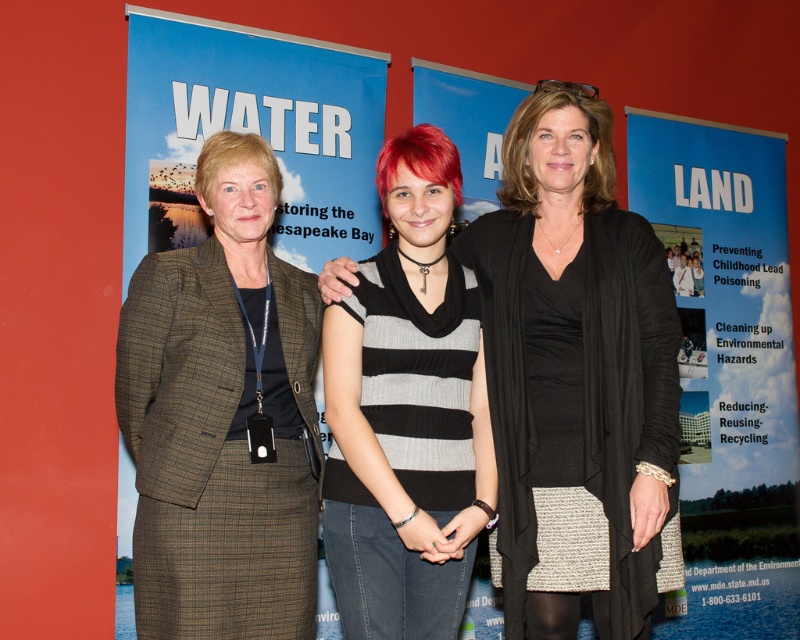
Question: Does plaid wool suit at center have a lesser width compared to blue fabric poster at right?

Choices:
 (A) yes
 (B) no

Answer: (A)

Question: Among these objects, which one is farthest from the camera?

Choices:
 (A) black knit sweater at center
 (B) striped sweater at center
 (C) plaid wool suit at center

Answer: (A)

Question: Is black knit sweater at center below blue fabric poster at right?

Choices:
 (A) no
 (B) yes

Answer: (A)

Question: Which of these objects is positioned closest to the blue fabric poster at right?

Choices:
 (A) striped sweater at center
 (B) plaid wool suit at center
 (C) black knit sweater at center

Answer: (C)

Question: Is black knit sweater at center positioned behind striped sweater at center?

Choices:
 (A) no
 (B) yes

Answer: (B)

Question: Which point appears closest to the camera in this image?

Choices:
 (A) (178, 316)
 (B) (454, 269)
 (C) (746, 532)
 (D) (604, 301)

Answer: (A)